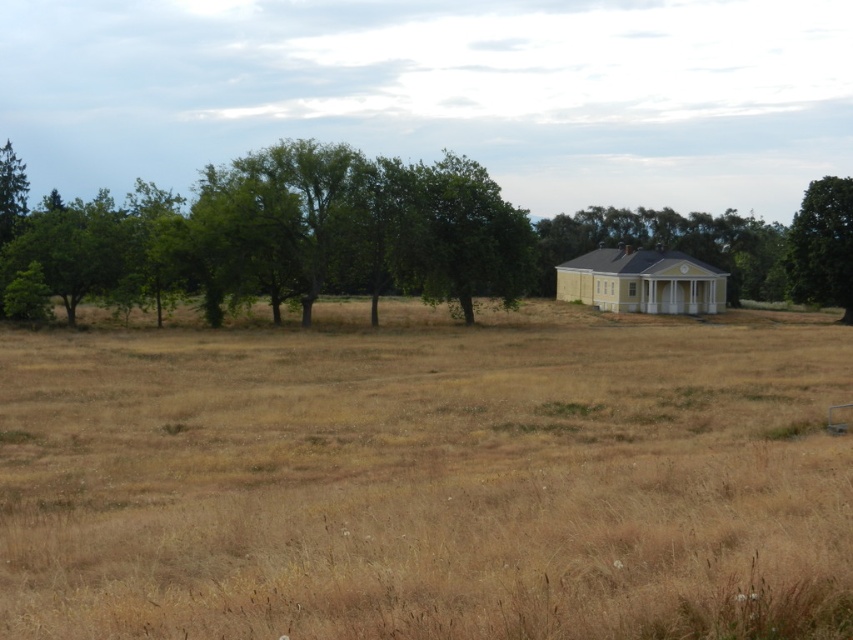
Question: Based on their relative distances, which object is nearer to the yellow matte house at center?

Choices:
 (A) green leafy tree at center
 (B) dry grass at center
 (C) yellow painted wood house at center
 (D) green leafy tree at right

Answer: (C)

Question: Is the position of dry grass at center less distant than that of green leafy tree at center?

Choices:
 (A) yes
 (B) no

Answer: (A)

Question: Can you confirm if dry grass at center is positioned below yellow matte house at center?

Choices:
 (A) no
 (B) yes

Answer: (B)

Question: Based on their relative distances, which object is nearer to the dry grass at center?

Choices:
 (A) yellow painted wood house at center
 (B) green leafy tree at right
 (C) green leafy tree at center

Answer: (C)

Question: Among these objects, which one is farthest from the camera?

Choices:
 (A) dry grass at center
 (B) green leafy tree at right
 (C) yellow painted wood house at center

Answer: (C)

Question: From the image, what is the correct spatial relationship of yellow painted wood house at center in relation to green leafy tree at right?

Choices:
 (A) right
 (B) left

Answer: (B)